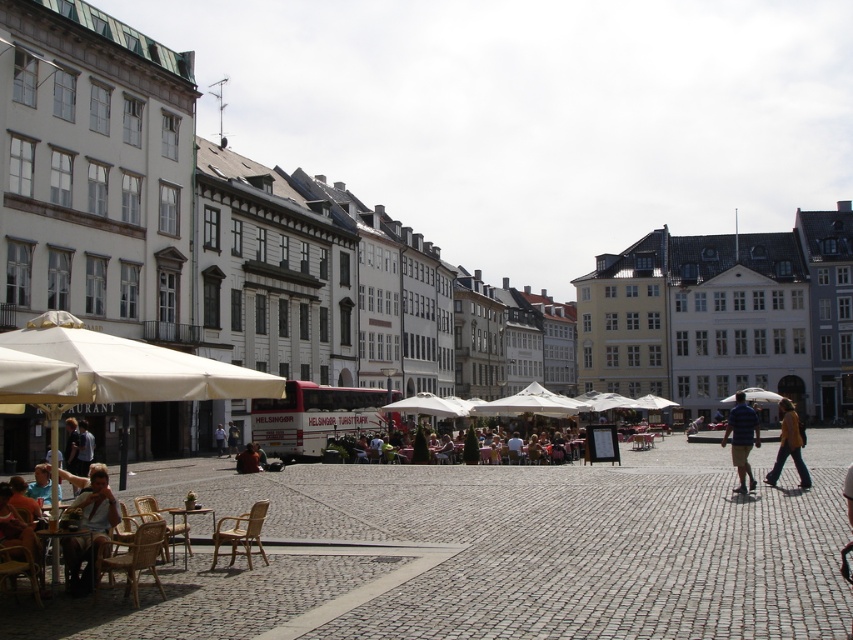
Question: From the image, what is the correct spatial relationship of brown leather bag at lower left in relation to wooden table at center?

Choices:
 (A) above
 (B) below

Answer: (A)

Question: Among these points, which one is farthest from the camera?

Choices:
 (A) (791, 422)
 (B) (173, 516)
 (C) (109, 493)

Answer: (A)

Question: Can you confirm if blue denim shorts at center-right is positioned to the right of light brown wooden chair at center?

Choices:
 (A) yes
 (B) no

Answer: (A)

Question: Which object is the closest to the blue denim shorts at center-right?

Choices:
 (A) brown leather jacket at center
 (B) brown leather bag at lower left
 (C) wooden table at lower left

Answer: (A)

Question: Among these points, which one is nearest to the camera?

Choices:
 (A) (248, 460)
 (B) (62, 554)
 (C) (199, 380)

Answer: (B)

Question: Can you confirm if brown leather bag at lower left is positioned to the right of light brown wooden chair at center?

Choices:
 (A) no
 (B) yes

Answer: (B)